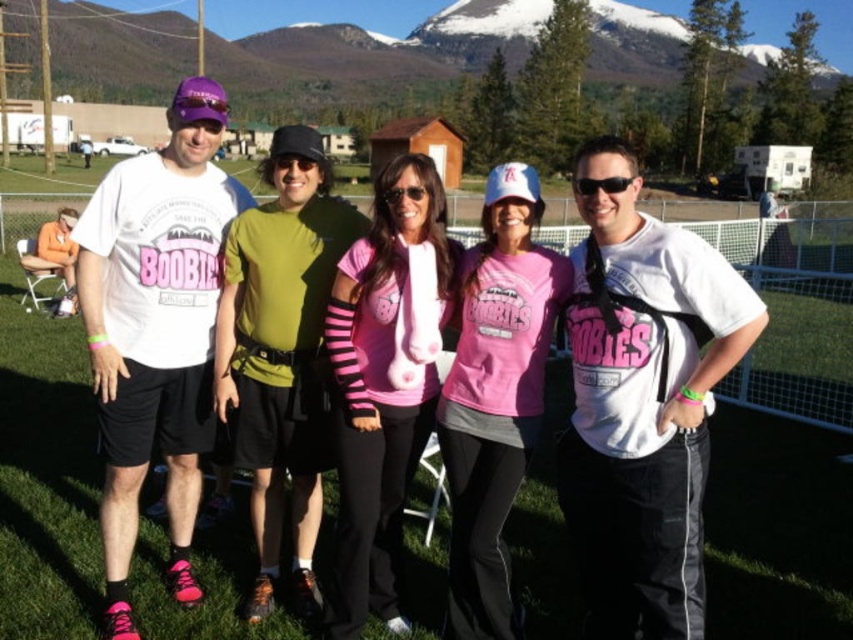
Question: Does pink matte t-shirt at center have a lesser width compared to black plastic sunglasses at center?

Choices:
 (A) no
 (B) yes

Answer: (A)

Question: Which object appears closest to the camera in this image?

Choices:
 (A) pink matte shirt at center
 (B) pink matte t-shirt at center

Answer: (A)

Question: Which of these objects is positioned closest to the pink matte t-shirt at center?

Choices:
 (A) black plastic sunglasses at center
 (B) pink matte shirt at center

Answer: (B)

Question: Is pink matte t-shirt at center smaller than black plastic sunglasses at center?

Choices:
 (A) no
 (B) yes

Answer: (A)

Question: Based on their relative distances, which object is farther from the pink matte shirt at center?

Choices:
 (A) black plastic sunglasses at center
 (B) pink matte t-shirt at center

Answer: (A)

Question: Can you confirm if pink matte t-shirt at center is positioned below pink matte shirt at center?

Choices:
 (A) no
 (B) yes

Answer: (A)